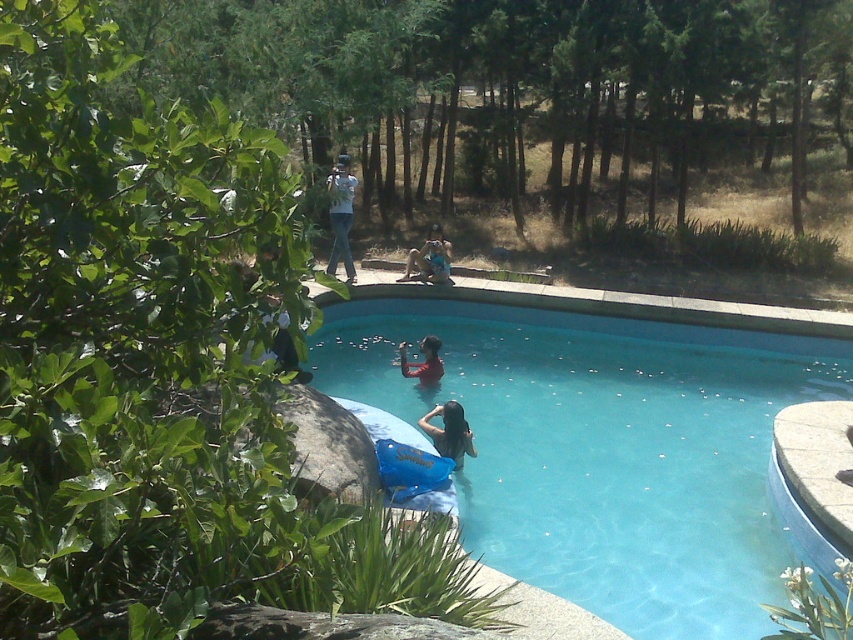
Question: Does dark brown hair at lower center have a lesser width compared to matte red shirt at center?

Choices:
 (A) yes
 (B) no

Answer: (B)

Question: Among these objects, which one is farthest from the camera?

Choices:
 (A) matte red shirt at center
 (B) white cotton shirt at upper center

Answer: (B)

Question: Which point is farther to the camera?

Choices:
 (A) (689, 326)
 (B) (422, 253)
 (C) (352, 269)

Answer: (B)

Question: Does transparent blue water at center have a smaller size compared to matte red shirt at center?

Choices:
 (A) yes
 (B) no

Answer: (A)

Question: Is white cotton shirt at upper center below blue fabric at center?

Choices:
 (A) no
 (B) yes

Answer: (A)

Question: Which point is closer to the camera?

Choices:
 (A) (700, 340)
 (B) (345, 166)
 (C) (416, 259)
 (D) (456, 429)

Answer: (D)